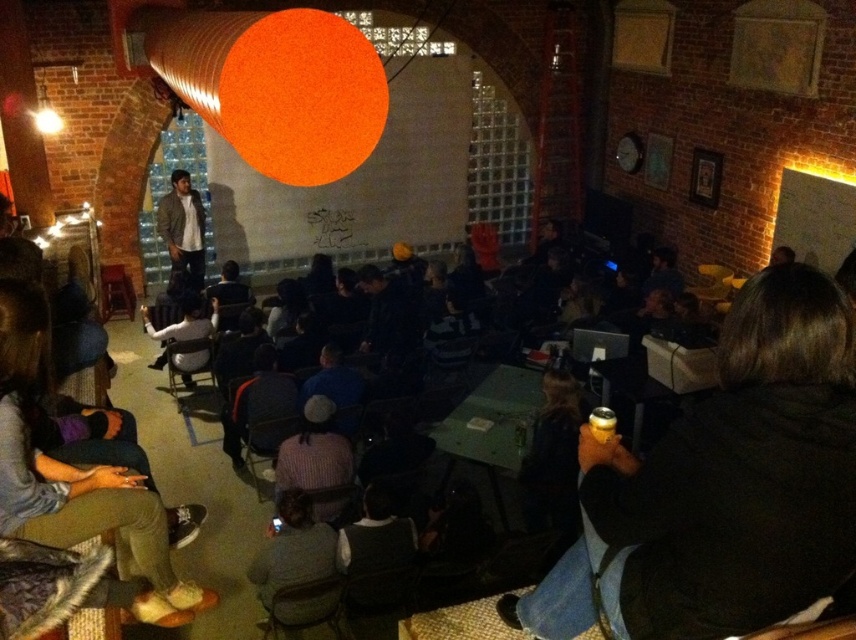
Question: Which object is positioned farthest from the black matte jacket at lower right?

Choices:
 (A) light brown leather jacket at center
 (B) denim jacket at lower left

Answer: (A)

Question: Observing the image, what is the correct spatial positioning of black matte jacket at lower right in reference to denim jacket at lower left?

Choices:
 (A) left
 (B) right

Answer: (B)

Question: Is black matte jacket at lower right to the left of denim jacket at lower left from the viewer's perspective?

Choices:
 (A) no
 (B) yes

Answer: (A)

Question: Is denim jacket at lower left to the left of light brown leather jacket at center from the viewer's perspective?

Choices:
 (A) yes
 (B) no

Answer: (B)

Question: Which object is farther from the camera taking this photo?

Choices:
 (A) denim jacket at lower left
 (B) black matte jacket at lower right

Answer: (A)

Question: Considering the real-world distances, which object is farthest from the denim jacket at lower left?

Choices:
 (A) black matte jacket at lower right
 (B) light brown leather jacket at center

Answer: (B)